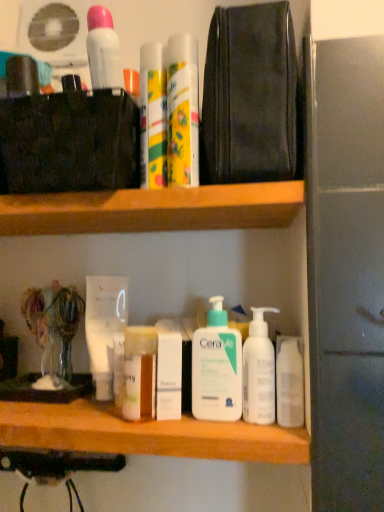
Question: Considering the positions of wooden at upper center and black leather pouch at upper center in the image, is wooden at upper center wider or thinner than black leather pouch at upper center?

Choices:
 (A) wide
 (B) thin

Answer: (A)

Question: Based on their positions, is wooden at upper center located to the left or right of black leather pouch at upper center?

Choices:
 (A) right
 (B) left

Answer: (B)

Question: Which object is positioned closest to the white pump bottle at center, the 2th cleaning product positioned from the right?

Choices:
 (A) black leather pouch at upper center
 (B) white matte lotion at center, which ranks as the third toiletry in top-to-bottom order
 (C) matte plastic spray cans at upper center, placed as the 3th toiletry when sorted from bottom to top
 (D) white matte tube at center, placed as the third mouthwash when sorted from right to left
 (E) white matte spray can at upper center, marked as the 2th mouthwash in a left-to-right arrangement

Answer: (B)

Question: Which of these objects is positioned farthest from the white matte spray can at upper center, the third mouthwash positioned from the back?

Choices:
 (A) wooden at upper center
 (B) white matte lotion at center, the first toiletry when ordered from bottom to top
 (C) floral-patterned plastic mouthwash at upper center, placed as the second mouthwash when sorted from back to front
 (D) matte plastic spray cans at upper center, the first toiletry when ordered from top to bottom
 (E) translucent plastic jar at center, the 2th toiletry in the bottom-to-top sequence

Answer: (E)